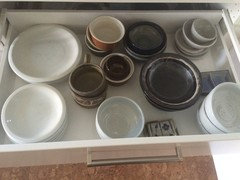
I want to click on white plate, so click(54, 65).